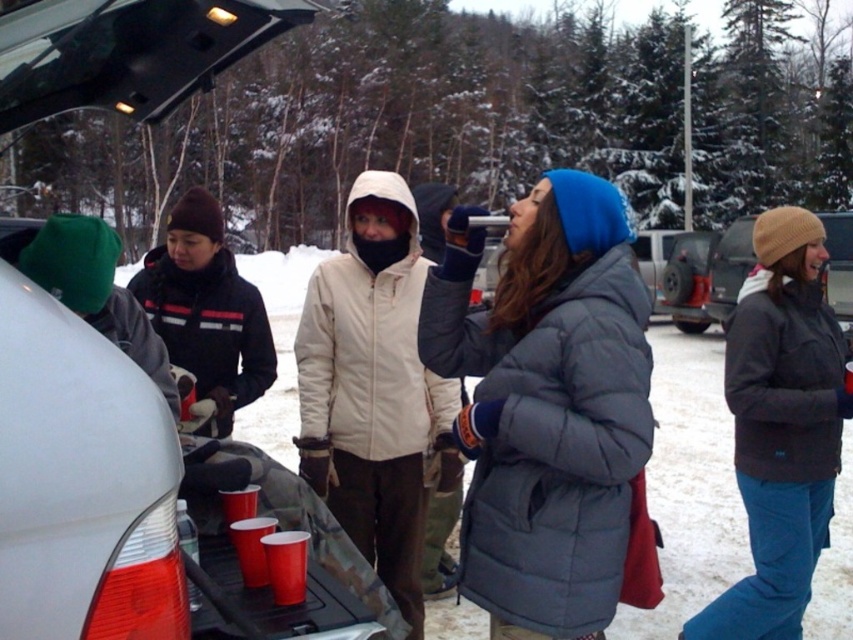
Which is more to the right, matte black suv at right or shiny plastic cup at lower center?

From the viewer's perspective, matte black suv at right appears more on the right side.

Can you confirm if matte black suv at right is positioned below shiny plastic cup at lower center?

No.

Find the location of `matte black suv at right`. matte black suv at right is located at coordinates (706, 275).

Can you confirm if dark gray fleece jacket at center is thinner than shiny plastic cup at lower center?

Incorrect, dark gray fleece jacket at center's width is not less than shiny plastic cup at lower center's.

Describe the element at coordinates (780, 428) in the screenshot. The width and height of the screenshot is (853, 640). I see `dark gray fleece jacket at center` at that location.

Who is more distant from viewer, (751,554) or (297,596)?

The point (751,554) is behind.

The image size is (853, 640). I want to click on dark gray fleece jacket at center, so click(780, 428).

Does gray puffy coat at center appear over black fleece jacket at left?

No, gray puffy coat at center is not above black fleece jacket at left.

Which is above, gray puffy coat at center or black fleece jacket at left?

black fleece jacket at left

What do you see at coordinates (546, 404) in the screenshot? Image resolution: width=853 pixels, height=640 pixels. I see `gray puffy coat at center` at bounding box center [546, 404].

In order to click on gray puffy coat at center in this screenshot , I will do `click(546, 404)`.